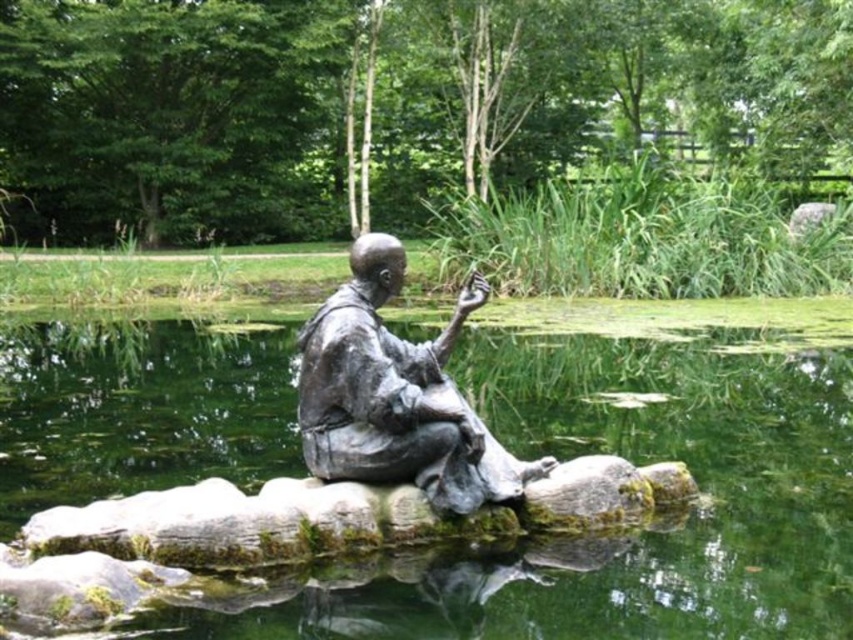
Which is below, green mossy rock at center or bronze statue at center?

bronze statue at center is below.

Who is more forward, [556,374] or [376,412]?

Point [376,412] is in front.

Who is more forward, (x=532, y=413) or (x=490, y=451)?

Positioned in front is point (x=490, y=451).

Find the location of a particular element. Image resolution: width=853 pixels, height=640 pixels. green mossy rock at center is located at coordinates (635, 464).